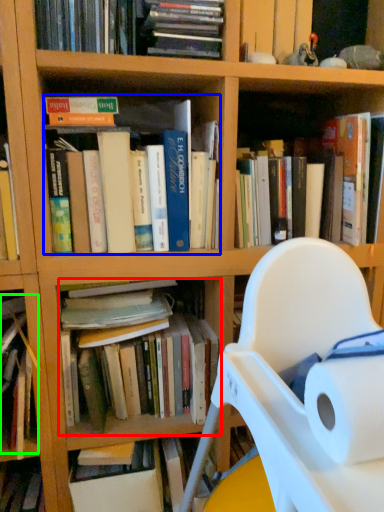
Question: Which object is the farthest from book (highlighted by a red box)? Choose among these: book (highlighted by a blue box) or book (highlighted by a green box).

Choices:
 (A) book
 (B) book

Answer: (A)